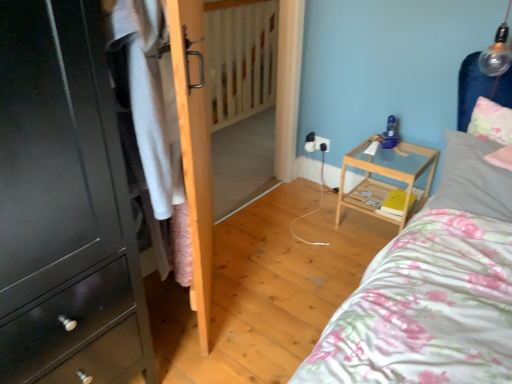
Question: Should I look upward or downward to see gray fabric pillow at upper right, placed as the 1th pillow when sorted from bottom to top?

Choices:
 (A) down
 (B) up

Answer: (B)

Question: Is white cotton shirt at left a part of light wood/transparent glass nightstand at center-right?

Choices:
 (A) yes
 (B) no

Answer: (B)

Question: From a real-world perspective, is light wood/transparent glass nightstand at center-right over white cotton shirt at left?

Choices:
 (A) no
 (B) yes

Answer: (A)

Question: From the image's perspective, is light wood/transparent glass nightstand at center-right below white cotton shirt at left?

Choices:
 (A) yes
 (B) no

Answer: (A)

Question: Does light wood/transparent glass nightstand at center-right have a larger size compared to white cotton shirt at left?

Choices:
 (A) no
 (B) yes

Answer: (B)

Question: Can you confirm if light wood/transparent glass nightstand at center-right is shorter than white cotton shirt at left?

Choices:
 (A) yes
 (B) no

Answer: (A)

Question: From the image's perspective, would you say light wood/transparent glass nightstand at center-right is positioned over white cotton shirt at left?

Choices:
 (A) yes
 (B) no

Answer: (B)

Question: Does white cotton shirt at left have a smaller size compared to matte black cabinet at left?

Choices:
 (A) yes
 (B) no

Answer: (A)

Question: Does white cotton shirt at left come in front of matte black cabinet at left?

Choices:
 (A) yes
 (B) no

Answer: (B)

Question: Does white cotton shirt at left have a greater width compared to matte black cabinet at left?

Choices:
 (A) no
 (B) yes

Answer: (A)

Question: Is white cotton shirt at left bigger than matte black cabinet at left?

Choices:
 (A) yes
 (B) no

Answer: (B)

Question: Can you confirm if white cotton shirt at left is taller than matte black cabinet at left?

Choices:
 (A) no
 (B) yes

Answer: (A)

Question: Is the position of white cotton shirt at left more distant than that of matte black cabinet at left?

Choices:
 (A) no
 (B) yes

Answer: (B)

Question: Considering the relative sizes of white cotton shirt at left and fluffy white pillow at upper right, which is the 1th pillow in top-to-bottom order, in the image provided, is white cotton shirt at left bigger than fluffy white pillow at upper right, which is the 1th pillow in top-to-bottom order,?

Choices:
 (A) yes
 (B) no

Answer: (A)